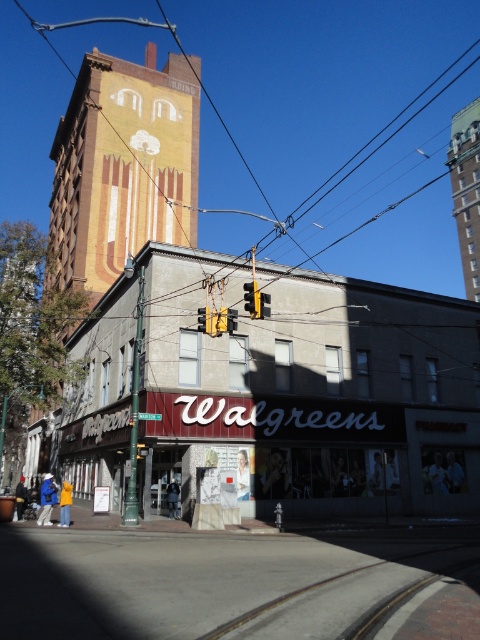
Can you confirm if brown brick tower at upper center is taller than yellow metal train track at lower center?

Yes, brown brick tower at upper center is taller than yellow metal train track at lower center.

Between point (466, 205) and point (326, 579), which one is positioned behind?

The point (466, 205) is more distant.

This screenshot has height=640, width=480. Identify the location of brown brick tower at upper center. (467, 189).

Who is more distant from viewer, (245, 301) or (204, 314)?

The point (204, 314) is behind.

Where is `yellow plastic traffic light at center`? The width and height of the screenshot is (480, 640). yellow plastic traffic light at center is located at coordinates (252, 300).

Locate an element on the screen. This screenshot has height=640, width=480. yellow plastic traffic light at center is located at coordinates click(x=252, y=300).

Does brown brick tower at upper center have a lesser width compared to yellow plastic traffic light at center?

No, brown brick tower at upper center is not thinner than yellow plastic traffic light at center.

Can you confirm if brown brick tower at upper center is taller than yellow plastic traffic light at center?

Indeed, brown brick tower at upper center has a greater height compared to yellow plastic traffic light at center.

What do you see at coordinates (467, 189) in the screenshot? I see `brown brick tower at upper center` at bounding box center [467, 189].

You are a GUI agent. You are given a task and a screenshot of the screen. Output one action in this format:
    pyautogui.click(x=<x>, y=<y>)
    Task: Click on the brown brick tower at upper center
    
    Given the screenshot: What is the action you would take?
    pyautogui.click(x=467, y=189)